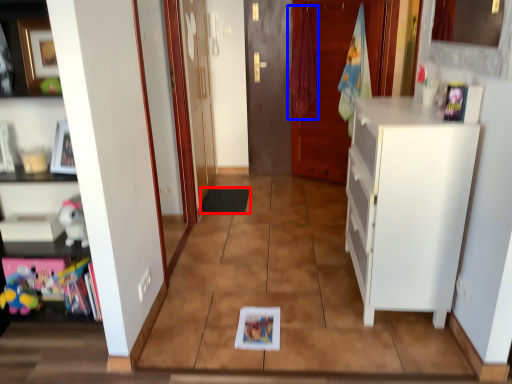
Question: Which object is further to the camera taking this photo, mat (highlighted by a red box) or laundry (highlighted by a blue box)?

Choices:
 (A) mat
 (B) laundry

Answer: (B)